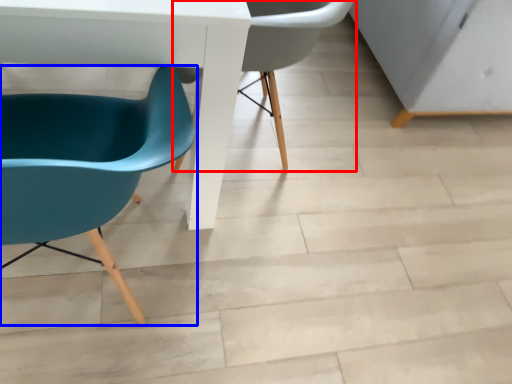
Question: Which point is closer to the camera, chair (highlighted by a red box) or chair (highlighted by a blue box)?

Choices:
 (A) chair
 (B) chair

Answer: (B)